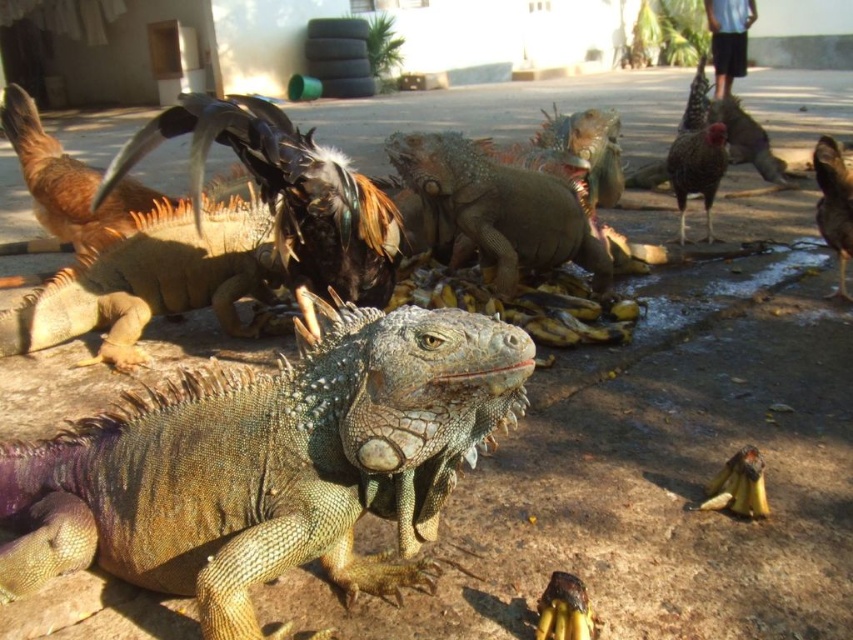
You are a zookeeper who needs to feed the iguanas. You have a green bucket near the building to collect the bananas. Which iguana, the shiny brown iguana at center or the green scaly iguana at center, requires a larger portion of bananas based on their size?

The shiny brown iguana at center requires a larger portion of bananas because its width is larger than the green scaly iguana at center.

You are standing at the entrance of the white building and want to pick up the shiny black feathers at center. Which direction should you walk to reach it?

The shiny black feathers at center is located at point (x=287, y=195), so you should walk towards the center of the image to reach it.

You are a researcher observing the iguanas. You need to determine which iguana is taller between the shiny brown iguana at center and the green scaly iguana at center. Which one is taller?

The shiny brown iguana at center is taller than the green scaly iguana at center.